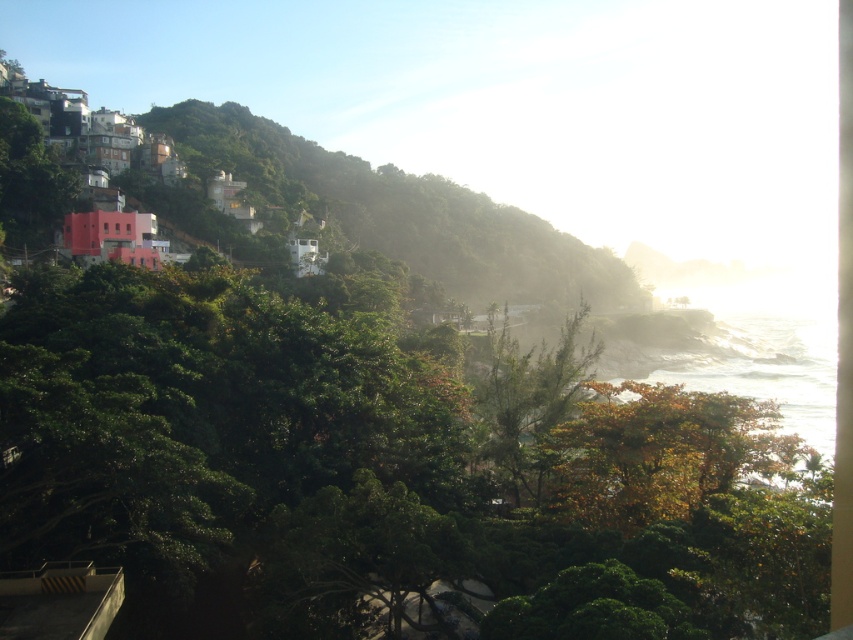
Question: Which of the following is the farthest from the observer?

Choices:
 (A) (352, 212)
 (B) (769, 436)

Answer: (A)

Question: Is green leafy hillside at upper left positioned before autumn leaves at center?

Choices:
 (A) yes
 (B) no

Answer: (B)

Question: Is green leafy hillside at upper left above autumn leaves at center?

Choices:
 (A) no
 (B) yes

Answer: (B)

Question: Can you confirm if green leafy hillside at upper left is positioned below autumn leaves at center?

Choices:
 (A) yes
 (B) no

Answer: (B)

Question: Which of the following is the closest to the observer?

Choices:
 (A) green leafy hillside at upper left
 (B) autumn leaves at center

Answer: (B)